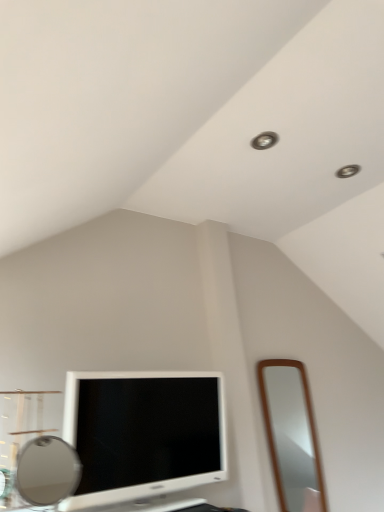
Image resolution: width=384 pixels, height=512 pixels. I want to click on brown wooden mirror at right, which is the second mirror from left to right, so click(291, 435).

The image size is (384, 512). Identify the location of matte silver mirror at lower left, which is counted as the first mirror, starting from the front. (47, 471).

You are a GUI agent. You are given a task and a screenshot of the screen. Output one action in this format:
    pyautogui.click(x=<x>, y=<y>)
    Task: Click on the brown wooden mirror at right, acting as the first mirror starting from the back
    The height and width of the screenshot is (512, 384).
    Given the screenshot: What is the action you would take?
    pyautogui.click(x=291, y=435)

From a real-world perspective, is matte silver mirror at lower left, which is counted as the first mirror, starting from the front, beneath white glossy television at lower left?

Correct, in the physical world, matte silver mirror at lower left, which is counted as the first mirror, starting from the front, is lower than white glossy television at lower left.

The height and width of the screenshot is (512, 384). I want to click on television below the matte silver mirror at lower left, which is counted as the first mirror, starting from the front (from the image's perspective), so click(x=144, y=433).

Is matte silver mirror at lower left, the first mirror when ordered from left to right, turned away from brown wooden mirror at right, which appears as the 1th mirror when viewed from the right?

No, matte silver mirror at lower left, the first mirror when ordered from left to right, is not facing away from brown wooden mirror at right, which appears as the 1th mirror when viewed from the right.

From the image's perspective, which one is positioned lower, matte silver mirror at lower left, the first mirror when ordered from left to right, or brown wooden mirror at right, which is the second mirror from left to right?

From the image's view, brown wooden mirror at right, which is the second mirror from left to right, is below.

Considering the sizes of matte silver mirror at lower left, which ranks as the second mirror in right-to-left order, and brown wooden mirror at right, which appears as the 1th mirror when viewed from the right, in the image, is matte silver mirror at lower left, which ranks as the second mirror in right-to-left order, wider or thinner than brown wooden mirror at right, which appears as the 1th mirror when viewed from the right,?

Clearly, matte silver mirror at lower left, which ranks as the second mirror in right-to-left order, has more width compared to brown wooden mirror at right, which appears as the 1th mirror when viewed from the right.

From a real-world perspective, is matte silver mirror at lower left, which is counted as the first mirror, starting from the front, physically above brown wooden mirror at right, which appears as the 1th mirror when viewed from the right?

Incorrect, from a real-world perspective, matte silver mirror at lower left, which is counted as the first mirror, starting from the front, is lower than brown wooden mirror at right, which appears as the 1th mirror when viewed from the right.

Does brown wooden mirror at right, acting as the first mirror starting from the back, contain white glossy television at lower left?

That's incorrect, white glossy television at lower left is not inside brown wooden mirror at right, acting as the first mirror starting from the back.

From the image's perspective, which is above, brown wooden mirror at right, which is counted as the second mirror, starting from the front, or white glossy television at lower left?

white glossy television at lower left, from the image's perspective.

Is brown wooden mirror at right, acting as the first mirror starting from the back, taller than white glossy television at lower left?

Yes.

At what (x,y) coordinates should I click in order to perform the action: click on television located above the brown wooden mirror at right, which is the second mirror from left to right (from a real-world perspective). Please return your answer as a coordinate pair (x, y). The height and width of the screenshot is (512, 384). Looking at the image, I should click on (144, 433).

From a real-world perspective, is white glossy television at lower left over brown wooden mirror at right, which is counted as the second mirror, starting from the front?

Yes.

Consider the image. Are white glossy television at lower left and brown wooden mirror at right, which appears as the 1th mirror when viewed from the right, far apart?

Yes.

Considering the sizes of white glossy television at lower left and brown wooden mirror at right, which is counted as the second mirror, starting from the front, in the image, is white glossy television at lower left bigger or smaller than brown wooden mirror at right, which is counted as the second mirror, starting from the front,?

Clearly, white glossy television at lower left is larger in size than brown wooden mirror at right, which is counted as the second mirror, starting from the front.

Based on the photo, are white glossy television at lower left and matte silver mirror at lower left, which ranks as the second mirror in right-to-left order, making contact?

No, white glossy television at lower left is not making contact with matte silver mirror at lower left, which ranks as the second mirror in right-to-left order.

From the image's perspective, is white glossy television at lower left above or below matte silver mirror at lower left, which ranks as the second mirror in right-to-left order?

Clearly, from the image's perspective, white glossy television at lower left is below matte silver mirror at lower left, which ranks as the second mirror in right-to-left order.

Is white glossy television at lower left bigger or smaller than matte silver mirror at lower left, the first mirror when ordered from left to right?

white glossy television at lower left is bigger than matte silver mirror at lower left, the first mirror when ordered from left to right.

Considering the relative positions of white glossy television at lower left and matte silver mirror at lower left, the first mirror when ordered from left to right, in the image provided, is white glossy television at lower left to the right of matte silver mirror at lower left, the first mirror when ordered from left to right, from the viewer's perspective?

Yes, white glossy television at lower left is to the right of matte silver mirror at lower left, the first mirror when ordered from left to right.

Is matte silver mirror at lower left, which is counted as the first mirror, starting from the front, at the back of brown wooden mirror at right, which is counted as the second mirror, starting from the front?

No, brown wooden mirror at right, which is counted as the second mirror, starting from the front, is not facing the opposite direction of matte silver mirror at lower left, which is counted as the first mirror, starting from the front.

Which is in front, brown wooden mirror at right, which is counted as the second mirror, starting from the front, or matte silver mirror at lower left, which ranks as the second mirror in right-to-left order?

matte silver mirror at lower left, which ranks as the second mirror in right-to-left order.

Measure the distance from brown wooden mirror at right, which is counted as the second mirror, starting from the front, to matte silver mirror at lower left, the first mirror when ordered from left to right.

brown wooden mirror at right, which is counted as the second mirror, starting from the front, is 2.91 meters away from matte silver mirror at lower left, the first mirror when ordered from left to right.

I want to click on television that is on the right side of matte silver mirror at lower left, which ranks as the second mirror in right-to-left order, so click(x=144, y=433).

Locate an element on the screen. mirror above the matte silver mirror at lower left, the first mirror when ordered from left to right (from a real-world perspective) is located at coordinates (291, 435).

In the scene shown: When comparing their distances from brown wooden mirror at right, acting as the first mirror starting from the back, does matte silver mirror at lower left, the second mirror in the back-to-front sequence, or white glossy television at lower left seem further?

The object further to brown wooden mirror at right, acting as the first mirror starting from the back, is white glossy television at lower left.

Estimate the real-world distances between objects in this image. Which object is closer to matte silver mirror at lower left, the second mirror in the back-to-front sequence, white glossy television at lower left or brown wooden mirror at right, acting as the first mirror starting from the back?

white glossy television at lower left lies closer to matte silver mirror at lower left, the second mirror in the back-to-front sequence, than the other object.

From the image, which object appears to be farther from matte silver mirror at lower left, the first mirror when ordered from left to right, brown wooden mirror at right, which appears as the 1th mirror when viewed from the right, or white glossy television at lower left?

brown wooden mirror at right, which appears as the 1th mirror when viewed from the right.

Estimate the real-world distances between objects in this image. Which object is closer to white glossy television at lower left, matte silver mirror at lower left, which ranks as the second mirror in right-to-left order, or brown wooden mirror at right, which is the second mirror from left to right?

matte silver mirror at lower left, which ranks as the second mirror in right-to-left order, lies closer to white glossy television at lower left than the other object.

From the image, which object appears to be nearer to white glossy television at lower left, brown wooden mirror at right, which appears as the 1th mirror when viewed from the right, or matte silver mirror at lower left, which ranks as the second mirror in right-to-left order?

matte silver mirror at lower left, which ranks as the second mirror in right-to-left order.

Considering their positions, is white glossy television at lower left positioned closer to brown wooden mirror at right, which appears as the 1th mirror when viewed from the right, than matte silver mirror at lower left, which ranks as the second mirror in right-to-left order?

The object closer to brown wooden mirror at right, which appears as the 1th mirror when viewed from the right, is matte silver mirror at lower left, which ranks as the second mirror in right-to-left order.

Find the location of a particular element. The image size is (384, 512). television between matte silver mirror at lower left, which ranks as the second mirror in right-to-left order, and brown wooden mirror at right, which appears as the 1th mirror when viewed from the right, along the z-axis is located at coordinates (144, 433).